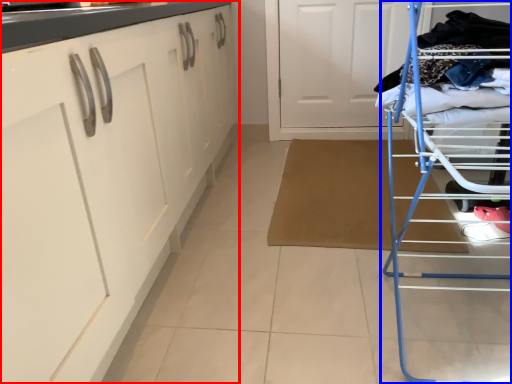
Question: Which point is closer to the camera, cabinetry (highlighted by a red box) or furniture (highlighted by a blue box)?

Choices:
 (A) cabinetry
 (B) furniture

Answer: (A)